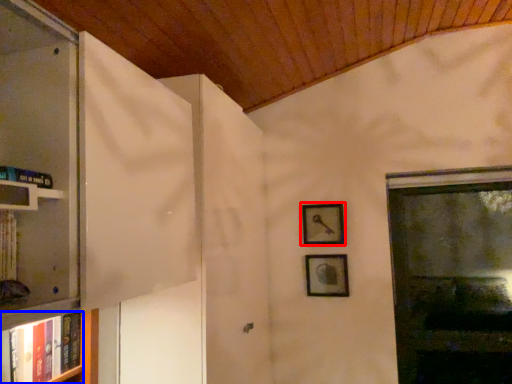
Question: Which point is further to the camera, picture frame (highlighted by a red box) or book (highlighted by a blue box)?

Choices:
 (A) picture frame
 (B) book

Answer: (A)